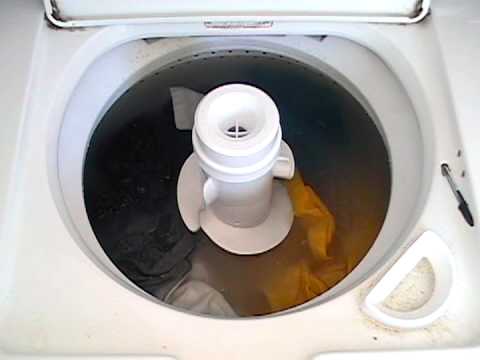
The height and width of the screenshot is (360, 480). I want to click on washer agitator, so [x=237, y=190].